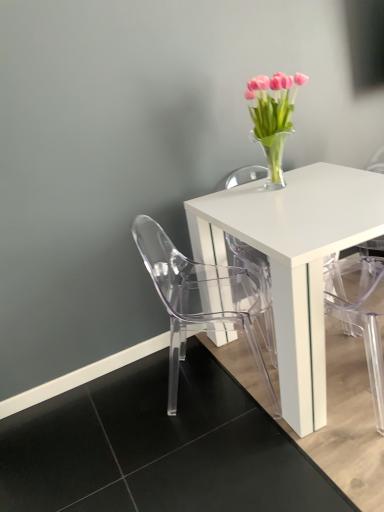
I want to click on free location to the left of pink glass vase at upper right, so click(x=239, y=193).